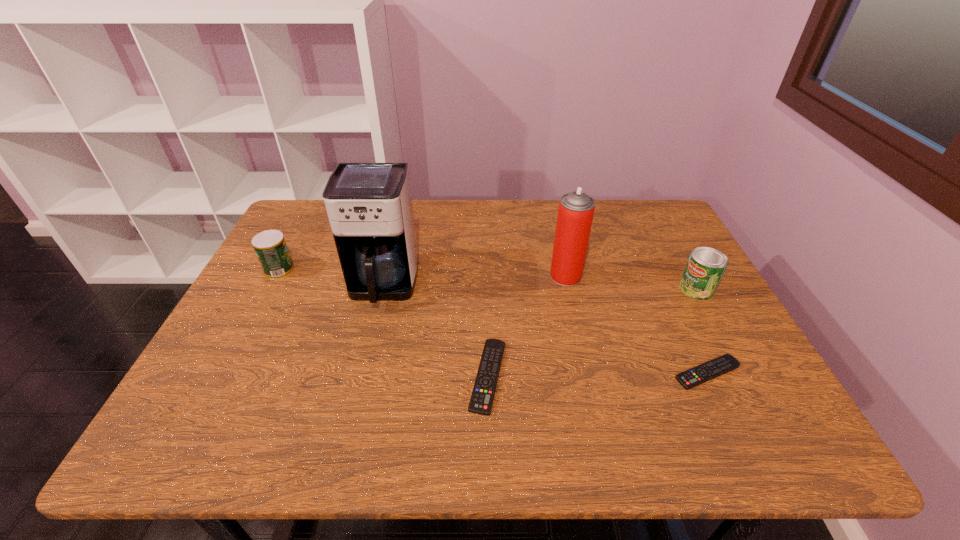
With all remote controls evenly spaced, where should an extra remote control be placed on the left to continue the pattern? Please point out a vacant space. Please provide its 2D coordinates. Your answer should be formatted as a tuple, i.e. [(x, y)], where the tuple contains the x and y coordinates of a point satisfying the conditions above.

[(265, 379)]